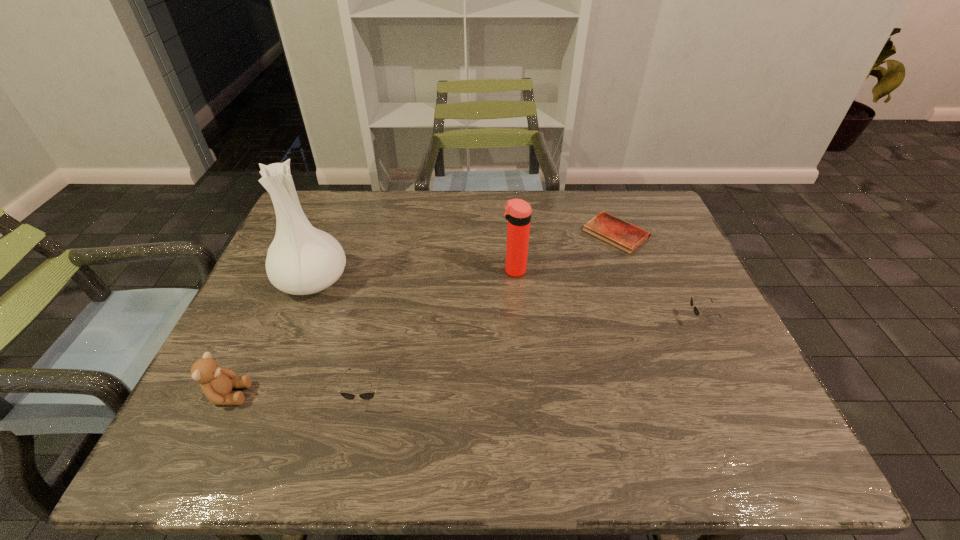
Where is `free spot between the tallest object and the third object from right to left`? The width and height of the screenshot is (960, 540). free spot between the tallest object and the third object from right to left is located at coordinates (414, 275).

Select which object is the fifth closest to the diary. Please provide its 2D coordinates. Your answer should be formatted as a tuple, i.e. [(x, y)], where the tuple contains the x and y coordinates of a point satisfying the conditions above.

[(217, 383)]

Point out which object is positioned as the fifth nearest to the taller sunglasses. Please provide its 2D coordinates. Your answer should be formatted as a tuple, i.e. [(x, y)], where the tuple contains the x and y coordinates of a point satisfying the conditions above.

[(696, 311)]

You are a GUI agent. You are given a task and a screenshot of the screen. Output one action in this format:
    pyautogui.click(x=<x>, y=<y>)
    Task: Click on the vacant space that satisfies the following two spatial constraints: 1. in front of the lenses of the farther sunglasses; 2. in front of the lenses of the taller sunglasses
    Image resolution: width=960 pixels, height=540 pixels.
    Given the screenshot: What is the action you would take?
    pyautogui.click(x=736, y=397)

Locate an element on the screen. vacant area that satisfies the following two spatial constraints: 1. in front of the lenses of the farther sunglasses; 2. in front of the lenses of the taller sunglasses is located at coordinates (736, 397).